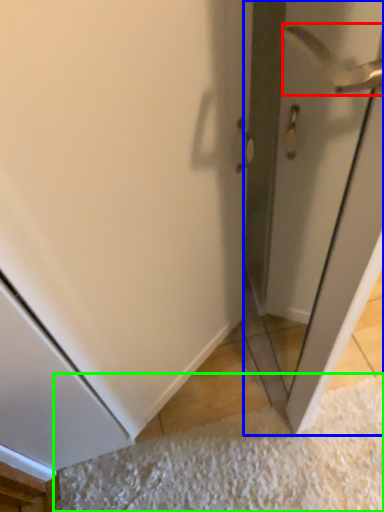
Question: Which is farther away from door handle (highlighted by a red box)? screen door (highlighted by a blue box) or doormat (highlighted by a green box)?

Choices:
 (A) screen door
 (B) doormat

Answer: (B)